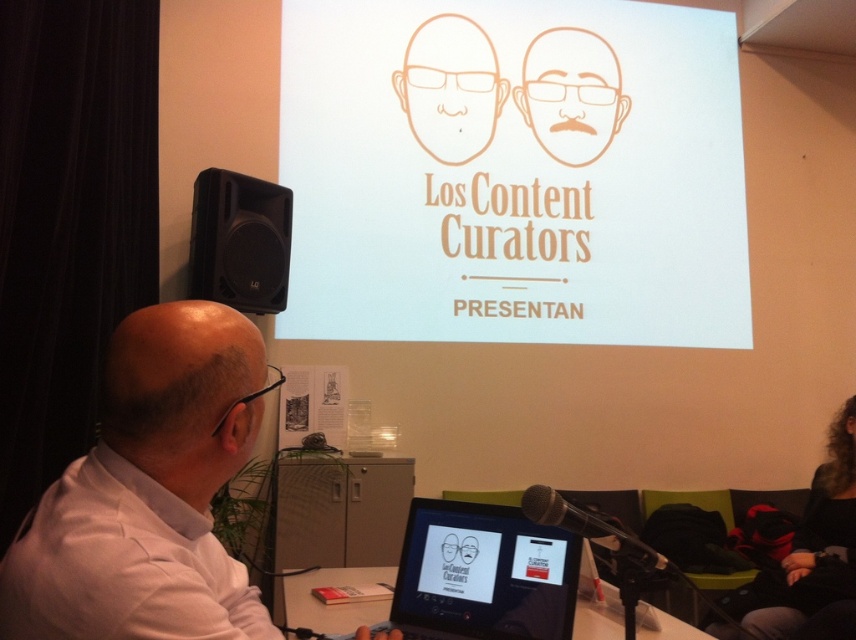
Question: Which point is closer to the camera?

Choices:
 (A) (477, 536)
 (B) (819, 538)
 (C) (134, 390)

Answer: (C)

Question: Estimate the real-world distances between objects in this image. Which object is closer to the white shirt at left?

Choices:
 (A) black plastic speaker at left
 (B) curly hair at lower right
 (C) black plastic table at lower center

Answer: (C)

Question: Which object appears closest to the camera in this image?

Choices:
 (A) white shirt at left
 (B) black glossy laptop at center
 (C) curly hair at lower right
 (D) orange line drawing face at center

Answer: (A)

Question: Is white paper at center bigger than black plastic speaker at left?

Choices:
 (A) yes
 (B) no

Answer: (A)

Question: Can you confirm if black glossy laptop at center is positioned to the left of black plastic speaker at left?

Choices:
 (A) yes
 (B) no

Answer: (B)

Question: Is black glossy laptop at center below orange line drawing face at center?

Choices:
 (A) yes
 (B) no

Answer: (A)